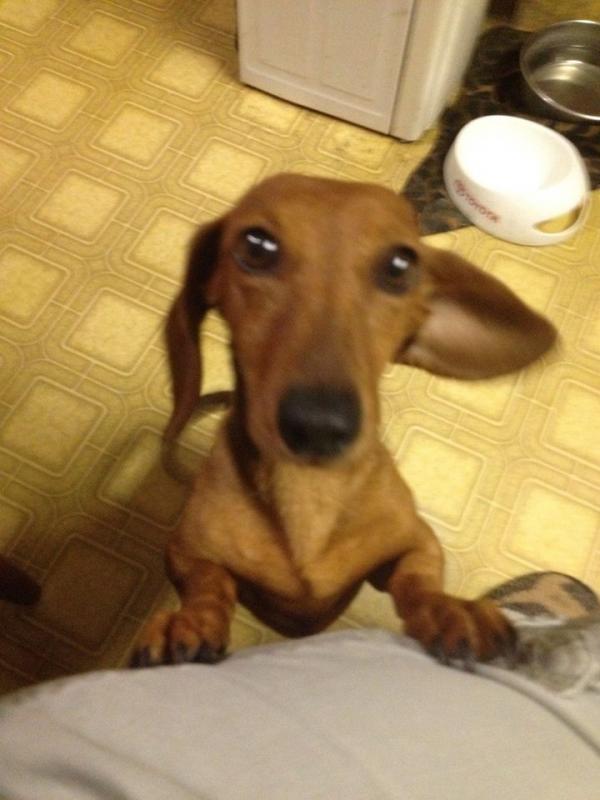
Image resolution: width=600 pixels, height=800 pixels. Identify the location of nasty yellowish floor. (85, 38).